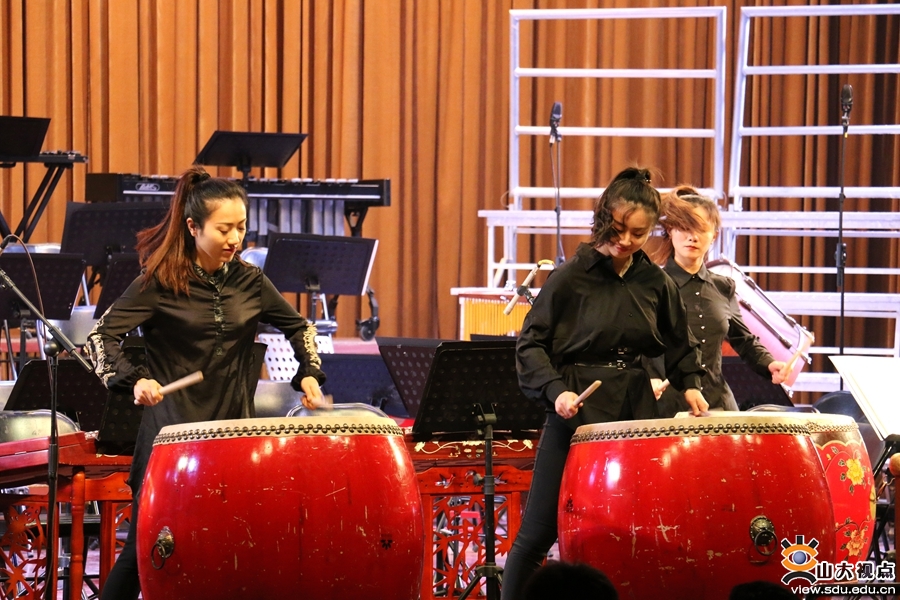
Locate an element on the screen. white risers is located at coordinates (761, 215), (714, 157).